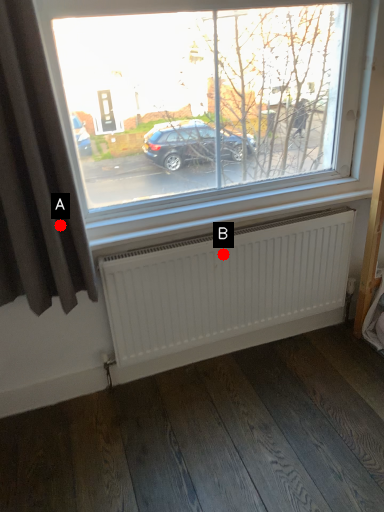
Question: Two points are circled on the image, labeled by A and B beside each circle. Which of the following is the closest to the observer?

Choices:
 (A) A is closer
 (B) B is closer

Answer: (A)